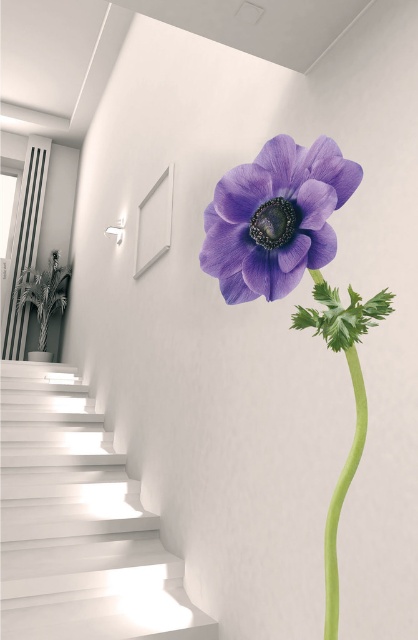
You are an interior designer planning to place a decorative item in the hallway. The space available is exactly the width of the green smooth stem at center. Can the matte purple flower at center fit in that space?

The matte purple flower at center is wider than the green smooth stem at center, so it cannot fit in the space allocated for the stem.

You are standing in the hallway and want to place a small decorative item between the white smooth stairs at lower left and the green smooth stem at center. Based on their positions, where should you place it to ensure it is between them?

The white smooth stairs at lower left is positioned on the left side of green smooth stem at center, so placing the decorative item between them would require positioning it to the right of the white smooth stairs at lower left and to the left of the green smooth stem at center.

From the picture: You are standing in the hallway and want to take a photo of the point at coordinates (318,268). Your camera has a focal length of 24mm and you are currently 18.78 inches away from the point. Is the point within the camera frame?

The point at coordinates (318,268) is 18.78 inches away from the camera, so yes, it is within the camera frame as the distance matches the required focal length.